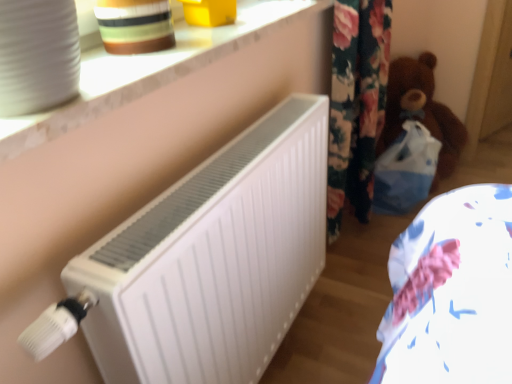
Question: From a real-world perspective, is striped ceramic pot at upper left on white matte radiator at center?

Choices:
 (A) no
 (B) yes

Answer: (B)

Question: Is striped ceramic pot at upper left at the right side of white matte radiator at center?

Choices:
 (A) yes
 (B) no

Answer: (B)

Question: From a real-world perspective, does striped ceramic pot at upper left sit lower than white matte radiator at center?

Choices:
 (A) no
 (B) yes

Answer: (A)

Question: Is striped ceramic pot at upper left outside of white matte radiator at center?

Choices:
 (A) no
 (B) yes

Answer: (B)

Question: Can you confirm if striped ceramic pot at upper left is bigger than white matte radiator at center?

Choices:
 (A) no
 (B) yes

Answer: (A)

Question: From the image's perspective, is brown plush teddy bear at right located above or below white matte radiator at center?

Choices:
 (A) above
 (B) below

Answer: (A)

Question: Visually, is brown plush teddy bear at right positioned to the left or to the right of white matte radiator at center?

Choices:
 (A) right
 (B) left

Answer: (A)

Question: Is brown plush teddy bear at right wider or thinner than white matte radiator at center?

Choices:
 (A) thin
 (B) wide

Answer: (B)

Question: Considering their positions, is brown plush teddy bear at right located in front of or behind white matte radiator at center?

Choices:
 (A) front
 (B) behind

Answer: (B)

Question: Is point (11, 145) positioned closer to the camera than point (130, 321)?

Choices:
 (A) farther
 (B) closer

Answer: (B)

Question: Would you say white marble window sill at upper center is inside or outside white matte radiator at center?

Choices:
 (A) outside
 (B) inside

Answer: (A)

Question: From their relative heights in the image, would you say white marble window sill at upper center is taller or shorter than white matte radiator at center?

Choices:
 (A) short
 (B) tall

Answer: (A)

Question: Is white marble window sill at upper center in front of or behind white matte radiator at center in the image?

Choices:
 (A) front
 (B) behind

Answer: (A)

Question: Looking at their shapes, would you say brown plush teddy bear at right is wider or thinner than striped ceramic pot at upper left?

Choices:
 (A) wide
 (B) thin

Answer: (A)

Question: From a real-world perspective, relative to striped ceramic pot at upper left, is brown plush teddy bear at right vertically above or below?

Choices:
 (A) below
 (B) above

Answer: (A)